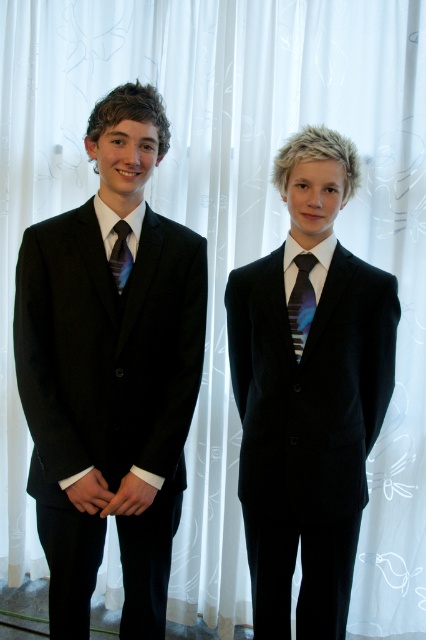
You are organizing a formal event and need to ensure that all guests have ties of the same size. You notice two ties in the image, the shiny blue tie at center and the matte black tie at left. Which tie should you adjust to match the other in size?

The shiny blue tie at center is bigger than the matte black tie at left, so you should adjust the shiny blue tie at center to be smaller to match the matte black tie at left.

You are a photographer setting up for a formal event. You notice the matte black suit at left and the matte black tie at left in the scene. Which item is located more to the left side?

The matte black suit at left is positioned on the left side of the matte black tie at left, so the matte black suit at left is more to the left.